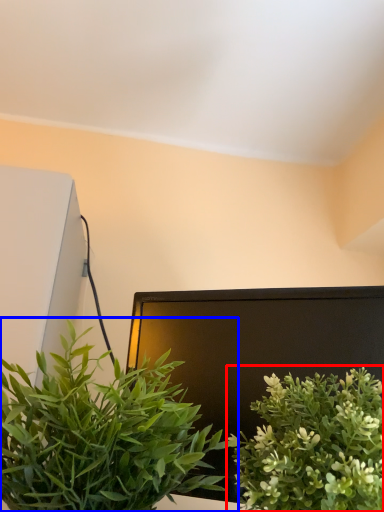
Question: Which object is closer to the camera taking this photo, houseplant (highlighted by a red box) or houseplant (highlighted by a blue box)?

Choices:
 (A) houseplant
 (B) houseplant

Answer: (B)